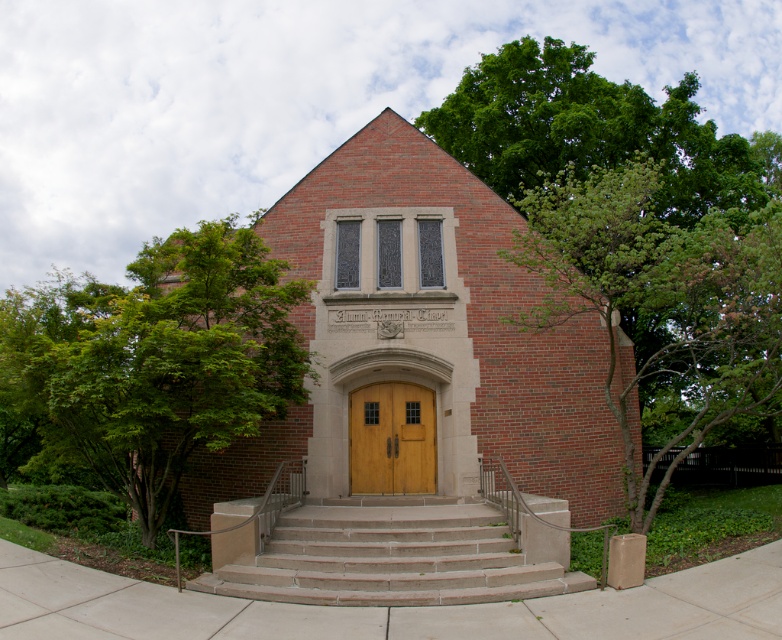
Question: Which of the following is the farthest from the observer?

Choices:
 (A) (332, 468)
 (B) (648, 376)

Answer: (B)

Question: Which point is closer to the camera?

Choices:
 (A) smooth concrete stairs at center
 (B) brick building at center

Answer: (A)

Question: Considering the relative positions of brick building at center and smooth concrete stairs at center in the image provided, where is brick building at center located with respect to smooth concrete stairs at center?

Choices:
 (A) left
 (B) right

Answer: (A)

Question: Does brick building at center appear over smooth concrete stairs at center?

Choices:
 (A) no
 (B) yes

Answer: (B)

Question: Does green leafy tree at upper right have a smaller size compared to wooden at center?

Choices:
 (A) yes
 (B) no

Answer: (B)

Question: Among these points, which one is nearest to the camera?

Choices:
 (A) pyautogui.click(x=259, y=232)
 (B) pyautogui.click(x=74, y=289)
 (C) pyautogui.click(x=391, y=426)
 (D) pyautogui.click(x=343, y=508)

Answer: (D)